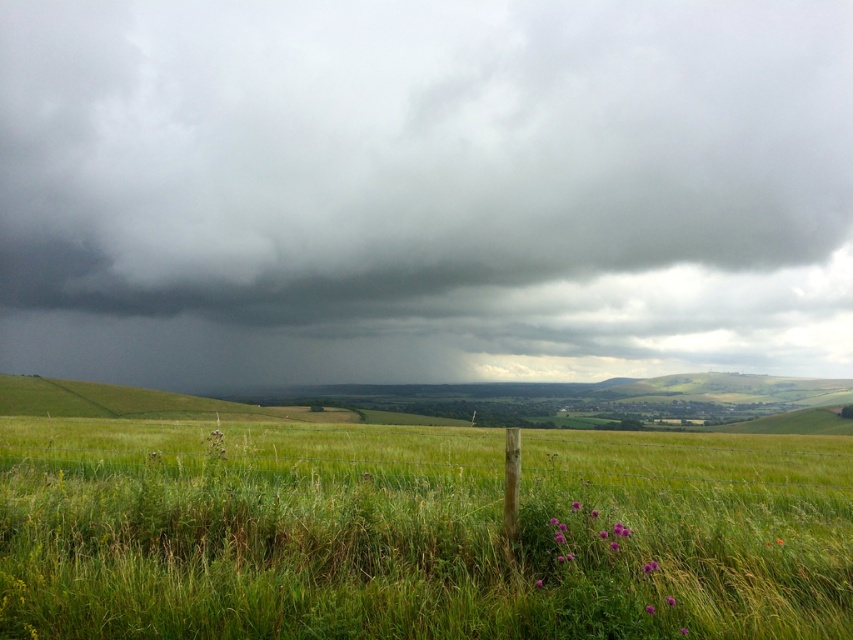
You are standing in the middle of the green grassy field at lower center and looking up at the dark gray cloud at upper center. Which object is closer to your eyes?

The dark gray cloud at upper center is closer to your eyes because it is further to the viewer than the green grassy field at lower center, meaning it appears nearer in the visual perspective.